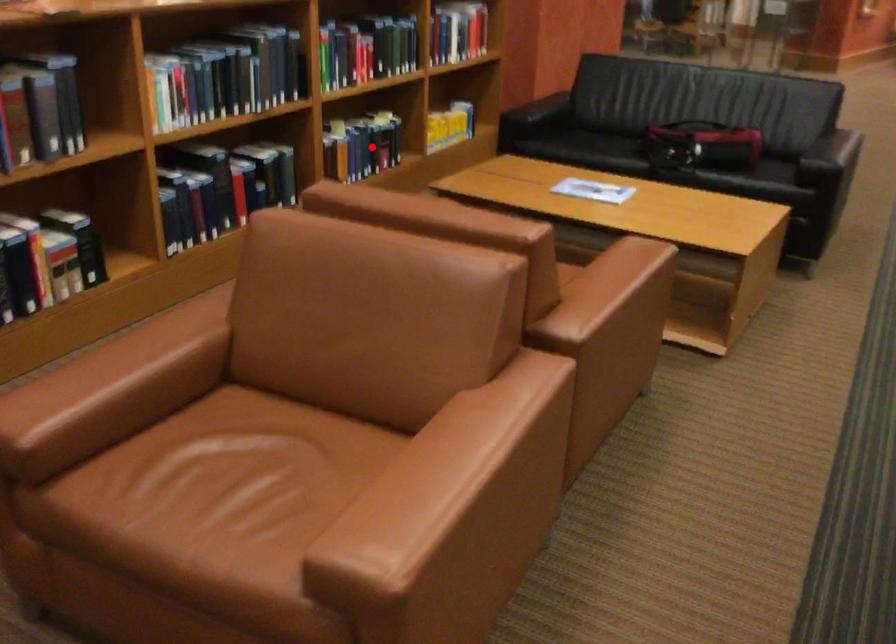
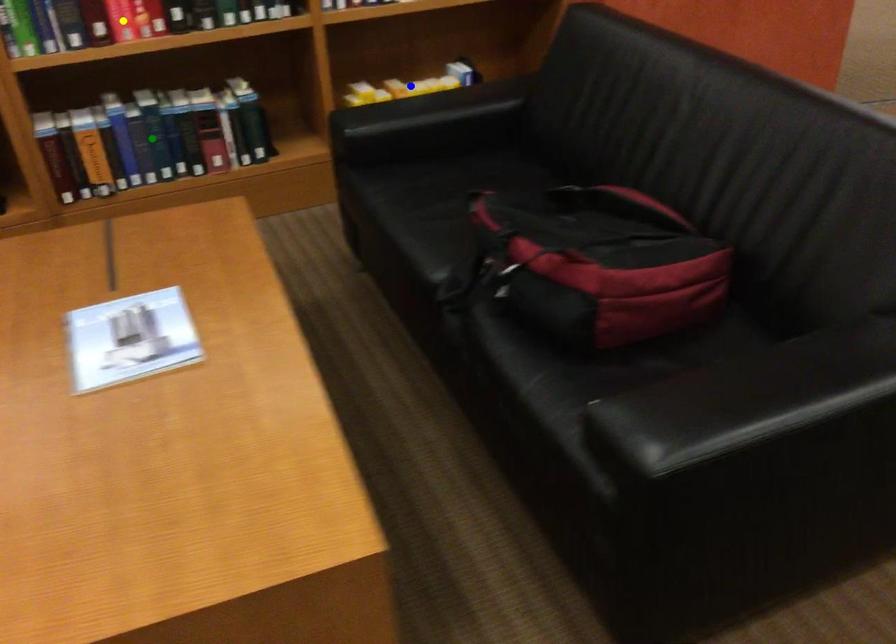
Question: I am providing you with two images of the same scene from different viewpoints. A red point is marked on the first image. You are given multiple points on the second image. In image 2, which mark is for the same physical point as the one in image 1?

Choices:
 (A) green point
 (B) blue point
 (C) yellow point

Answer: (A)